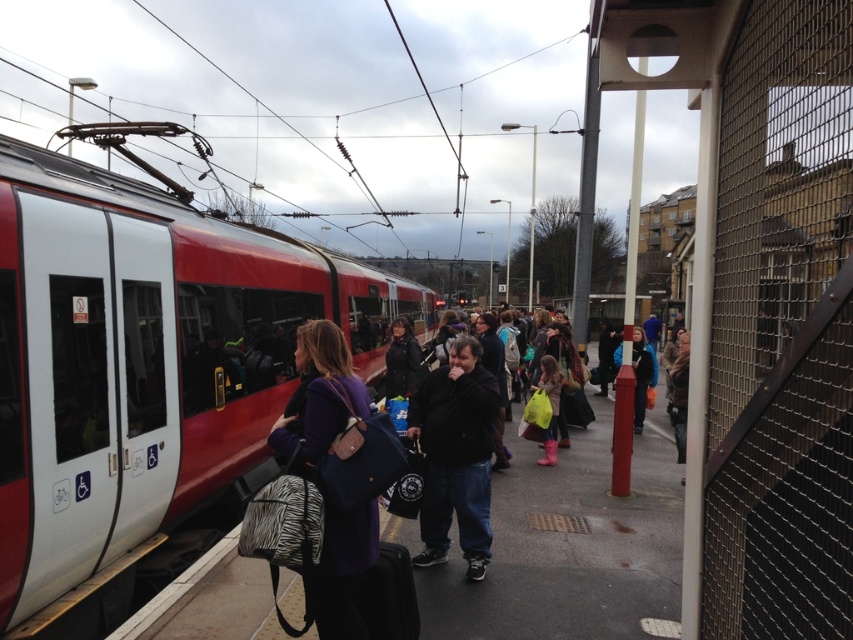
Question: Based on their relative distances, which object is farther from the red matte train at left?

Choices:
 (A) black cotton jacket at center
 (B) dark blue fabric jacket at center

Answer: (B)

Question: Where is dark blue fabric jacket at center located in relation to black cotton jacket at center in the image?

Choices:
 (A) left
 (B) right

Answer: (B)

Question: Can you confirm if dark blue fabric jacket at center is wider than black cotton jacket at center?

Choices:
 (A) no
 (B) yes

Answer: (A)

Question: Considering the real-world distances, which object is farthest from the red matte train at left?

Choices:
 (A) black cotton jacket at center
 (B) dark blue fabric jacket at center

Answer: (B)

Question: Which of the following is the farthest from the observer?

Choices:
 (A) red matte train at left
 (B) black cotton jacket at center

Answer: (B)

Question: Can you confirm if dark blue fabric jacket at center is positioned to the left of black cotton jacket at center?

Choices:
 (A) no
 (B) yes

Answer: (A)